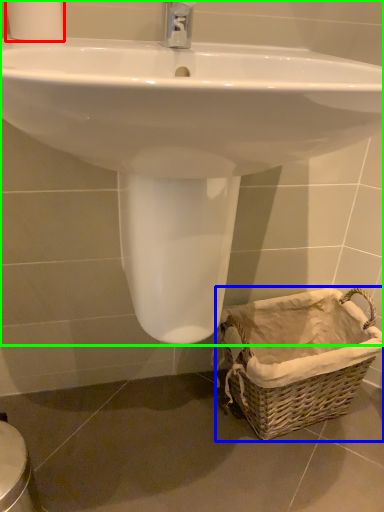
Question: Considering the real-world distances, which object is closest to toilet paper (highlighted by a red box)? basket (highlighted by a blue box) or sink (highlighted by a green box).

Choices:
 (A) basket
 (B) sink

Answer: (B)